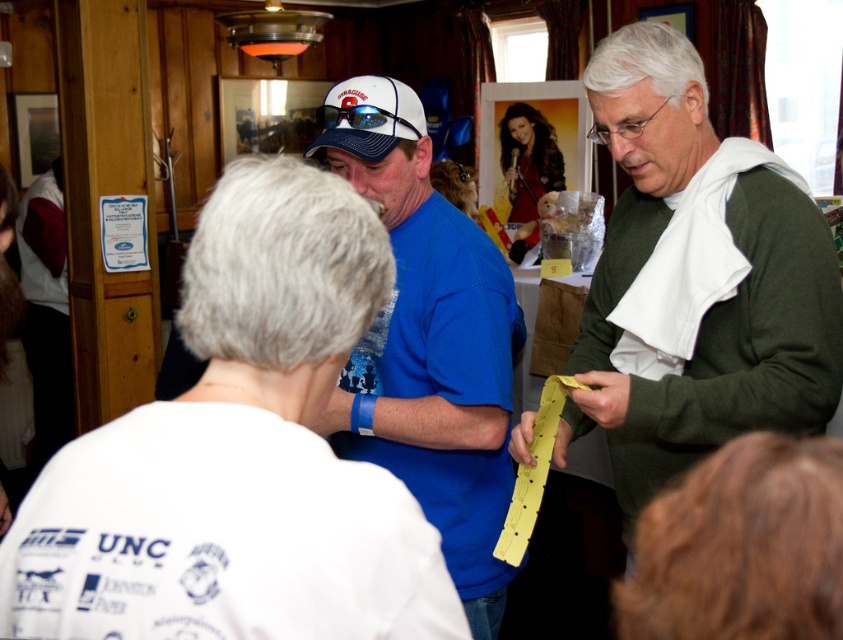
You are standing in the scene and want to locate the green matte sweater at right. According to the coordinates provided, where exactly should you look?

The green matte sweater at right is located at point 0.438 on the x axis and 0.826 on the y axis.

You are at a social event and see two people in the scene described. One is wearing a blue fabric shirt at center and the other has shiny brown hair at upper center. Which of these two is located more to the left?

The blue fabric shirt at center is positioned on the left side of shiny brown hair at upper center, so the blue fabric shirt at center is more to the left.